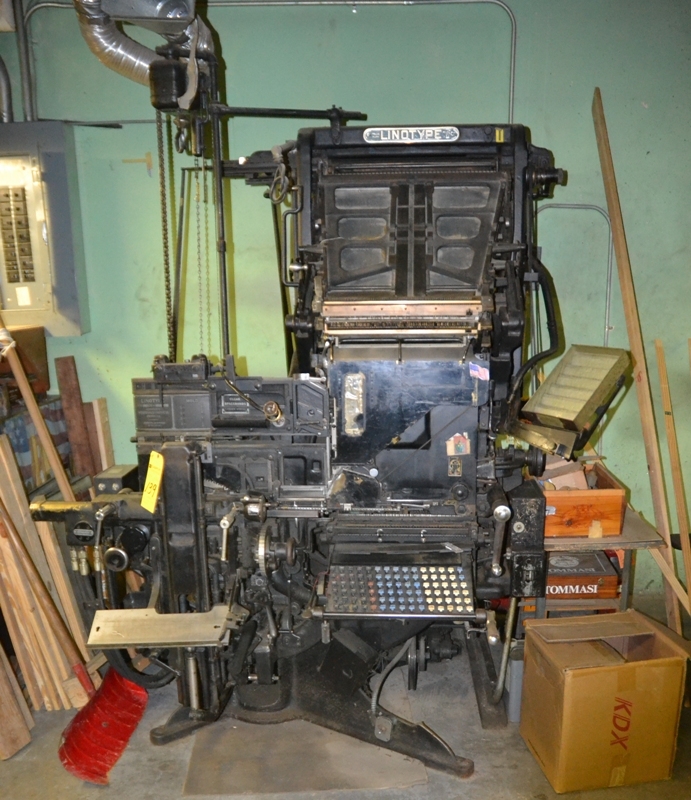
Identify the location of wooden crate. The width and height of the screenshot is (691, 800). (569, 502).